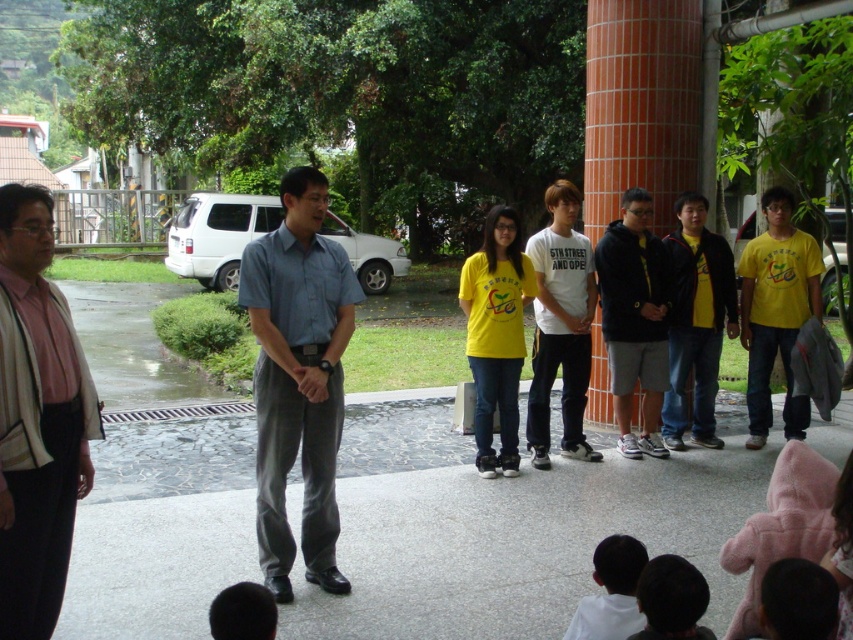
Does orange brick pillar at center have a larger size compared to black hoodie at center?

A: Correct, orange brick pillar at center is larger in size than black hoodie at center.

Looking at this image, does orange brick pillar at center lie behind black hoodie at center?

Yes, orange brick pillar at center is further from the viewer.

Who is more distant from viewer, (614, 184) or (630, 364)?

The point (614, 184) is behind.

The width and height of the screenshot is (853, 640). I want to click on orange brick pillar at center, so click(641, 106).

Does light blue fabric shirt at center have a greater height compared to smooth black hair at lower center?

Yes, light blue fabric shirt at center is taller than smooth black hair at lower center.

What do you see at coordinates (299, 378) in the screenshot? I see `light blue fabric shirt at center` at bounding box center [299, 378].

Is point (318, 282) positioned in front of point (683, 577)?

That is False.

Find the location of a particular element. light blue fabric shirt at center is located at coordinates (299, 378).

Who is higher up, white matte t-shirt at center or yellow matte jacket at center?

Positioned higher is yellow matte jacket at center.

Is white matte t-shirt at center behind yellow matte jacket at center?

That is False.

Is point (570, 321) closer to camera compared to point (699, 208)?

Yes, point (570, 321) is closer to viewer.

The width and height of the screenshot is (853, 640). In order to click on white matte t-shirt at center in this screenshot , I will do pos(560,324).